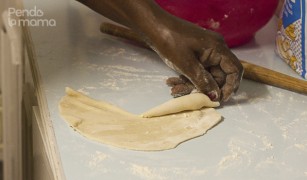
The width and height of the screenshot is (307, 180). What are the coordinates of `handle of rolling pin` in the screenshot? It's located at (114, 29), (290, 83).